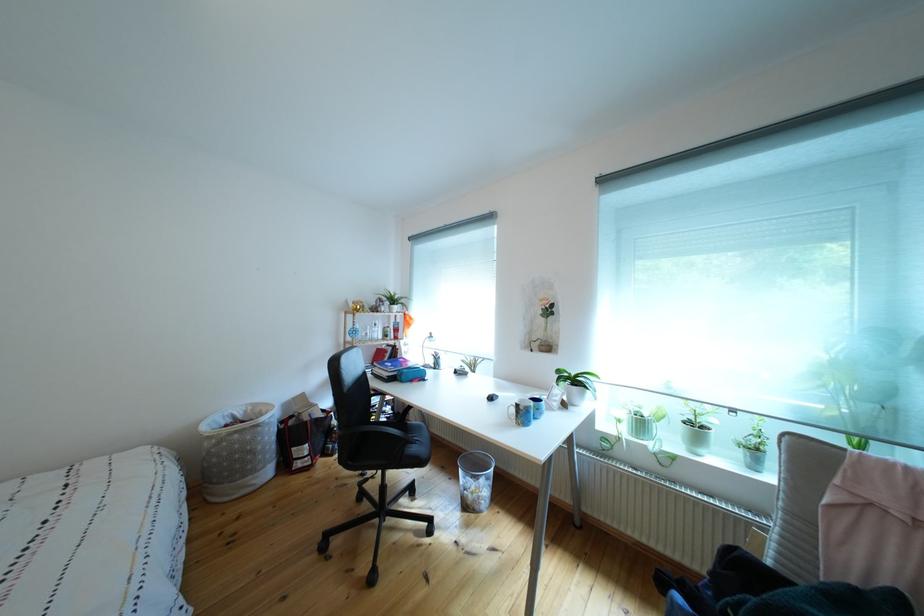
Which object does [520,411] point to?

It corresponds to the blue patterned mug in the image.